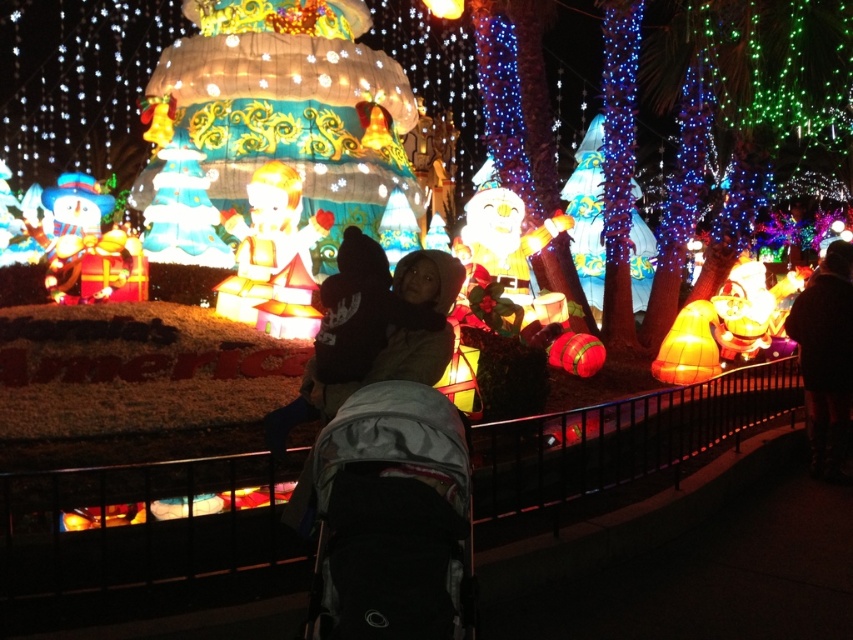
You are standing in front of the festive light display and want to take a photo. You notice two points in the scene, one at point coordinates point (323, 449) and the other at point coordinates point (822, 451). Which point will appear larger in your photo?

Point (323, 449) will appear larger in the photo because it is closer to the camera than point (822, 451).

You are a parent holding a baby and want to place the baby in the gray fabric baby carriage at center. However, you are currently standing near the dark brown leather jacket at right. Is the distance between you and the carriage sufficient to carry the baby safely without needing to adjust your grip?

The gray fabric baby carriage at center and dark brown leather jacket at right are 153.46 feet apart from each other. This distance is quite large, so you would need to adjust your grip multiple times while carrying the baby to the carriage.

Looking at this image, you are a parent holding a baby and need to place the baby in either the gray fabric baby carriage at center or the dark brown leather jacket at right. Which one is suitable for placing the baby?

The gray fabric baby carriage at center is suitable for placing the baby, as it is designed for carrying infants, whereas the dark brown leather jacket at right is clothing and not meant for holding a baby.